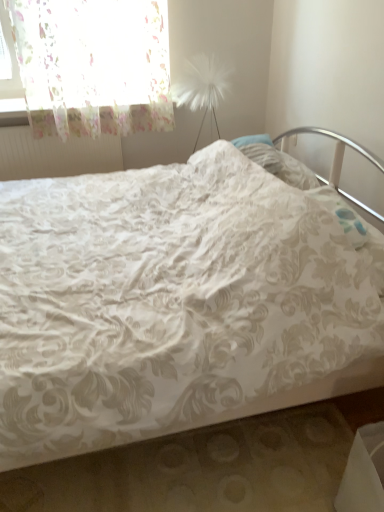
Question: Based on their sizes in the image, would you say white textured radiator at upper left is bigger or smaller than white floral fabric bed at center?

Choices:
 (A) small
 (B) big

Answer: (A)

Question: From the image's perspective, is white textured radiator at upper left above or below white floral fabric bed at center?

Choices:
 (A) below
 (B) above

Answer: (B)

Question: Estimate the real-world distances between objects in this image. Which object is closer to the white floral fabric bed at center?

Choices:
 (A) white textured radiator at upper left
 (B) translucent floral fabric at upper left

Answer: (B)

Question: Estimate the real-world distances between objects in this image. Which object is closer to the translucent floral fabric at upper left?

Choices:
 (A) white textured radiator at upper left
 (B) white floral fabric bed at center

Answer: (A)